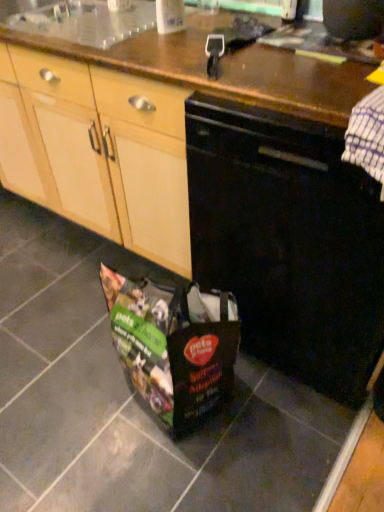
Question: Is white glossy container at upper center inside the boundaries of black matte dishwasher at center, or outside?

Choices:
 (A) inside
 (B) outside

Answer: (B)

Question: Is point [168, 12] positioned closer to the camera than point [352, 273]?

Choices:
 (A) farther
 (B) closer

Answer: (A)

Question: From their relative heights in the image, would you say white glossy container at upper center is taller or shorter than black matte dishwasher at center?

Choices:
 (A) tall
 (B) short

Answer: (B)

Question: From the image's perspective, is black matte dishwasher at center located above or below white glossy container at upper center?

Choices:
 (A) below
 (B) above

Answer: (A)

Question: From a real-world perspective, is black matte dishwasher at center above or below white glossy container at upper center?

Choices:
 (A) above
 (B) below

Answer: (B)

Question: In the image, is black matte dishwasher at center positioned in front of or behind white glossy container at upper center?

Choices:
 (A) behind
 (B) front

Answer: (B)

Question: Considering the relative positions of black matte dishwasher at center and white glossy container at upper center in the image provided, is black matte dishwasher at center to the left or to the right of white glossy container at upper center?

Choices:
 (A) left
 (B) right

Answer: (B)